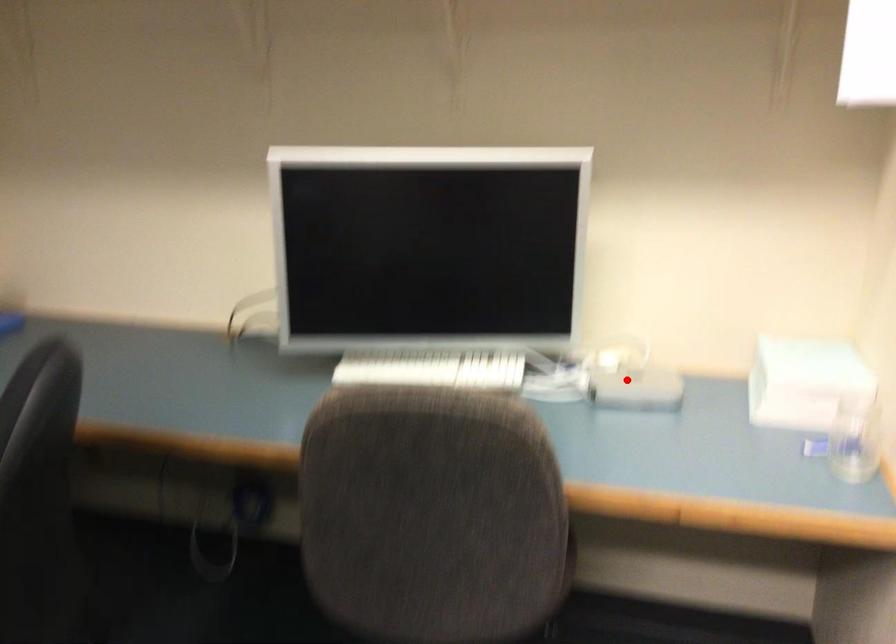
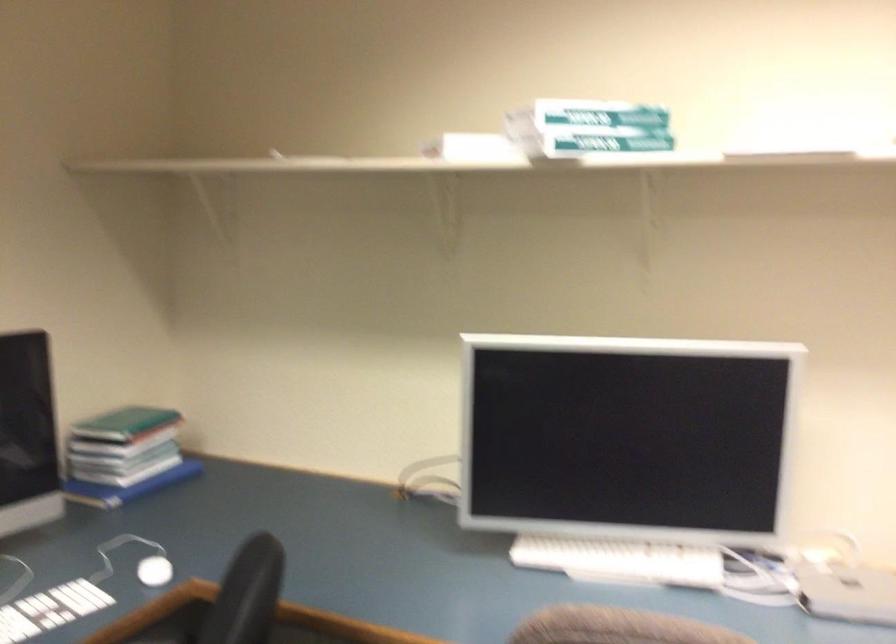
Question: I am providing you with two images of the same scene from different viewpoints. A red point is shown in image1. For the corresponding object point in image2, is it positioned nearer or farther from the camera?

Choices:
 (A) Nearer
 (B) Farther

Answer: (A)